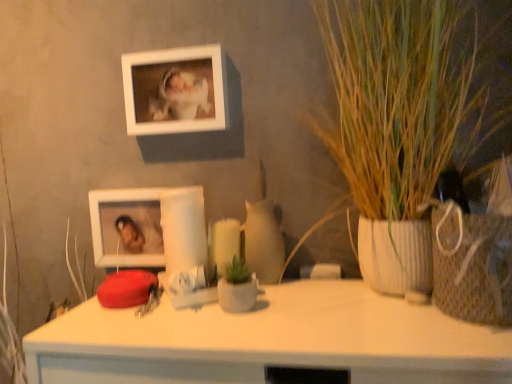
The height and width of the screenshot is (384, 512). What do you see at coordinates (399, 121) in the screenshot?
I see `green textured plant at right` at bounding box center [399, 121].

Identify the location of green textured plant at right. (399, 121).

Does point (449, 59) appear closer or farther from the camera than point (159, 133)?

Point (449, 59).

Is green textured plant at right situated inside white matte picture frame at upper center, marked as the second picture frame in a bottom-to-top arrangement, or outside?

green textured plant at right is spatially situated outside white matte picture frame at upper center, marked as the second picture frame in a bottom-to-top arrangement.

Between green textured plant at right and white matte picture frame at upper center, marked as the second picture frame in a bottom-to-top arrangement, which one has smaller size?

white matte picture frame at upper center, marked as the second picture frame in a bottom-to-top arrangement, is smaller.

Would you consider green textured plant at right to be distant from white matte picture frame at upper center, the 1th picture frame from the top?

No, green textured plant at right is not far from white matte picture frame at upper center, the 1th picture frame from the top.

How many degrees apart are the facing directions of white glossy picture frame at lower left, marked as the first picture frame in a bottom-to-top arrangement, and matte white candle at center?

The angle between the facing direction of white glossy picture frame at lower left, marked as the first picture frame in a bottom-to-top arrangement, and the facing direction of matte white candle at center is 0.144 degrees.

Based on the photo, from a real-world perspective, which object rests below the other?

matte white candle at center is physically lower.

Is matte white candle at center at the back of white glossy picture frame at lower left, marked as the first picture frame in a bottom-to-top arrangement?

That's not correct — white glossy picture frame at lower left, marked as the first picture frame in a bottom-to-top arrangement, is not looking away from matte white candle at center.

Which is further, (94, 210) or (219, 247)?

Point (94, 210)

From a real-world perspective, is green textured plant at right above or below white glossy picture frame at lower left, acting as the second picture frame starting from the top?

From a real-world perspective, green textured plant at right is physically above white glossy picture frame at lower left, acting as the second picture frame starting from the top.

Can you confirm if green textured plant at right is bigger than white glossy picture frame at lower left, acting as the second picture frame starting from the top?

Yes.

The width and height of the screenshot is (512, 384). I want to click on houseplant on the right side of white glossy picture frame at lower left, acting as the second picture frame starting from the top, so point(399,121).

Would you say green textured plant at right is to the left or to the right of white glossy picture frame at lower left, marked as the first picture frame in a bottom-to-top arrangement, in the picture?

Clearly, green textured plant at right is on the right of white glossy picture frame at lower left, marked as the first picture frame in a bottom-to-top arrangement, in the image.

Which object is wider, white matte picture frame at upper center, the 1th picture frame from the top, or white glossy picture frame at lower left, acting as the second picture frame starting from the top?

white glossy picture frame at lower left, acting as the second picture frame starting from the top.

From a real-world perspective, is white matte picture frame at upper center, the 1th picture frame from the top, physically located above or below white glossy picture frame at lower left, marked as the first picture frame in a bottom-to-top arrangement?

Answer: In terms of real-world spatial position, white matte picture frame at upper center, the 1th picture frame from the top, is above white glossy picture frame at lower left, marked as the first picture frame in a bottom-to-top arrangement.

Which object is positioned more to the right, white matte picture frame at upper center, the 1th picture frame from the top, or white glossy picture frame at lower left, marked as the first picture frame in a bottom-to-top arrangement?

white matte picture frame at upper center, the 1th picture frame from the top, is more to the right.

Considering the relative sizes of white matte picture frame at upper center, marked as the second picture frame in a bottom-to-top arrangement, and green textured plant at right in the image provided, is white matte picture frame at upper center, marked as the second picture frame in a bottom-to-top arrangement, wider than green textured plant at right?

No, white matte picture frame at upper center, marked as the second picture frame in a bottom-to-top arrangement, is not wider than green textured plant at right.

Considering the sizes of white matte picture frame at upper center, the 1th picture frame from the top, and green textured plant at right in the image, is white matte picture frame at upper center, the 1th picture frame from the top, bigger or smaller than green textured plant at right?

In the image, white matte picture frame at upper center, the 1th picture frame from the top, appears to be smaller than green textured plant at right.

How distant is white matte picture frame at upper center, the 1th picture frame from the top, from green textured plant at right?

white matte picture frame at upper center, the 1th picture frame from the top, is 13.16 inches from green textured plant at right.

Can you confirm if white matte picture frame at upper center, marked as the second picture frame in a bottom-to-top arrangement, is shorter than green textured plant at right?

Yes, white matte picture frame at upper center, marked as the second picture frame in a bottom-to-top arrangement, is shorter than green textured plant at right.

Between white glossy picture frame at lower left, acting as the second picture frame starting from the top, and white matte picture frame at upper center, marked as the second picture frame in a bottom-to-top arrangement, which one appears on the left side from the viewer's perspective?

From the viewer's perspective, white glossy picture frame at lower left, acting as the second picture frame starting from the top, appears more on the left side.

Which of these two, white glossy picture frame at lower left, marked as the first picture frame in a bottom-to-top arrangement, or white matte picture frame at upper center, marked as the second picture frame in a bottom-to-top arrangement, is thinner?

white matte picture frame at upper center, marked as the second picture frame in a bottom-to-top arrangement, is thinner.

Is white glossy picture frame at lower left, acting as the second picture frame starting from the top, not close to white matte picture frame at upper center, the 1th picture frame from the top?

No, there isn't a large distance between white glossy picture frame at lower left, acting as the second picture frame starting from the top, and white matte picture frame at upper center, the 1th picture frame from the top.

Does matte white candle at center turn towards green textured plant at right?

No, matte white candle at center is not aimed at green textured plant at right.

Considering the sizes of objects matte white candle at center and green textured plant at right in the image provided, who is wider, matte white candle at center or green textured plant at right?

Wider between the two is green textured plant at right.

From a real-world perspective, is matte white candle at center physically above green textured plant at right?

No, from a real-world perspective, matte white candle at center is not over green textured plant at right

Where is `houseplant below the white matte picture frame at upper center, the 1th picture frame from the top (from the image's perspective)`? This screenshot has height=384, width=512. houseplant below the white matte picture frame at upper center, the 1th picture frame from the top (from the image's perspective) is located at coordinates (399, 121).

Locate an element on the screen. This screenshot has height=384, width=512. candle beneath the white glossy picture frame at lower left, acting as the second picture frame starting from the top (from a real-world perspective) is located at coordinates (226, 243).

Which object lies nearer to the anchor point white glossy picture frame at lower left, marked as the first picture frame in a bottom-to-top arrangement, matte white candle at center or white matte picture frame at upper center, marked as the second picture frame in a bottom-to-top arrangement?

matte white candle at center is positioned closer to the anchor white glossy picture frame at lower left, marked as the first picture frame in a bottom-to-top arrangement.

From the image, which object appears to be farther from matte white candle at center, white matte picture frame at upper center, marked as the second picture frame in a bottom-to-top arrangement, or white glossy picture frame at lower left, marked as the first picture frame in a bottom-to-top arrangement?

white matte picture frame at upper center, marked as the second picture frame in a bottom-to-top arrangement, is positioned further to the anchor matte white candle at center.

Looking at the image, which one is located further to white matte picture frame at upper center, marked as the second picture frame in a bottom-to-top arrangement, green textured plant at right or white glossy picture frame at lower left, acting as the second picture frame starting from the top?

green textured plant at right lies further to white matte picture frame at upper center, marked as the second picture frame in a bottom-to-top arrangement, than the other object.

Estimate the real-world distances between objects in this image. Which object is further from white glossy picture frame at lower left, marked as the first picture frame in a bottom-to-top arrangement, green textured plant at right or white matte picture frame at upper center, marked as the second picture frame in a bottom-to-top arrangement?

Among the two, green textured plant at right is located further to white glossy picture frame at lower left, marked as the first picture frame in a bottom-to-top arrangement.

Based on their spatial positions, is matte white candle at center or white glossy picture frame at lower left, acting as the second picture frame starting from the top, closer to green textured plant at right?

Among the two, matte white candle at center is located nearer to green textured plant at right.

Considering their positions, is white matte picture frame at upper center, the 1th picture frame from the top, positioned further to green textured plant at right than white glossy picture frame at lower left, marked as the first picture frame in a bottom-to-top arrangement?

white glossy picture frame at lower left, marked as the first picture frame in a bottom-to-top arrangement, is further to green textured plant at right.

Considering their positions, is white glossy picture frame at lower left, marked as the first picture frame in a bottom-to-top arrangement, positioned closer to green textured plant at right than white matte picture frame at upper center, marked as the second picture frame in a bottom-to-top arrangement?

white matte picture frame at upper center, marked as the second picture frame in a bottom-to-top arrangement, lies closer to green textured plant at right than the other object.

When comparing their distances from green textured plant at right, does white matte picture frame at upper center, the 1th picture frame from the top, or matte white candle at center seem closer?

Based on the image, white matte picture frame at upper center, the 1th picture frame from the top, appears to be nearer to green textured plant at right.

Where is `candle between white glossy picture frame at lower left, marked as the first picture frame in a bottom-to-top arrangement, and green textured plant at right from left to right`? candle between white glossy picture frame at lower left, marked as the first picture frame in a bottom-to-top arrangement, and green textured plant at right from left to right is located at coordinates (226, 243).

The image size is (512, 384). I want to click on picture frame between white glossy picture frame at lower left, marked as the first picture frame in a bottom-to-top arrangement, and green textured plant at right from left to right, so click(174, 90).

This screenshot has width=512, height=384. Identify the location of picture frame between white matte picture frame at upper center, the 1th picture frame from the top, and matte white candle at center vertically. (127, 227).

I want to click on houseplant between white matte picture frame at upper center, marked as the second picture frame in a bottom-to-top arrangement, and matte white candle at center vertically, so click(x=399, y=121).